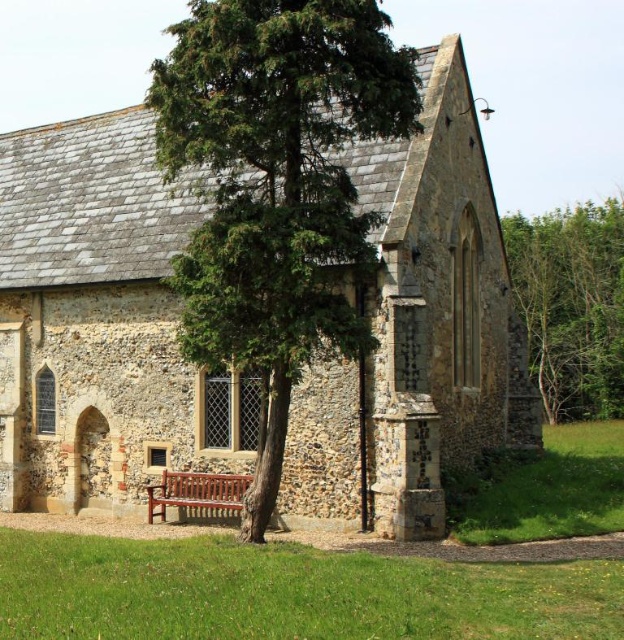
You are standing in front of the church and want to take a photo that includes both the pointed arch window and the small arched doorway. Which of the two points, point (x=240, y=104) or point (x=539, y=333), is closer to the camera?

Point (x=240, y=104) is closer to the camera than point (x=539, y=333).

You are planning to place a new flower pot between the green textured tree at center and the polished wood bench at center. Based on their widths, which object should the flower pot be closer to?

The green textured tree at center has a larger width than the polished wood bench at center. Therefore, the flower pot should be placed closer to the polished wood bench at center to maintain balance between the two objects.